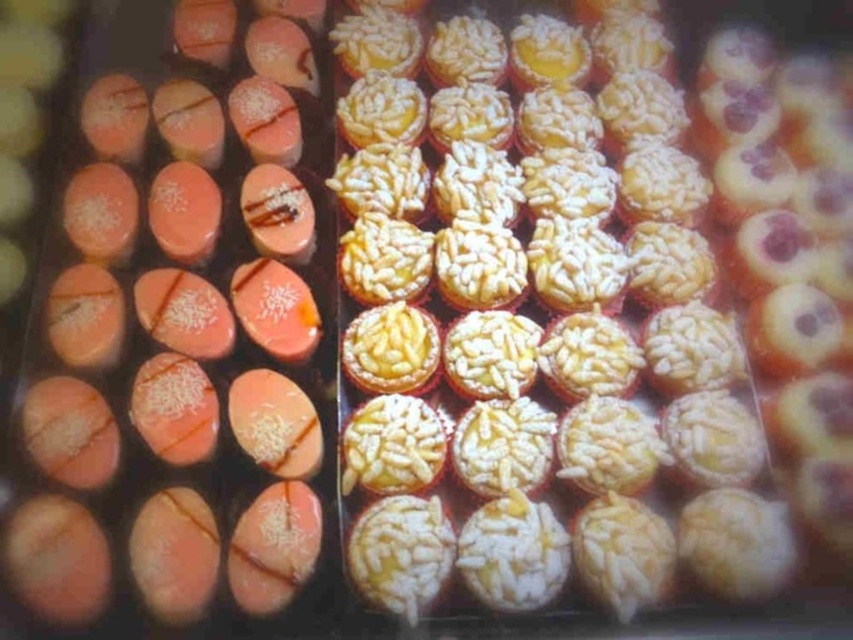
Question: Can you confirm if white sugary cupcake at center is positioned above matte pink chocolate at center?

Choices:
 (A) yes
 (B) no

Answer: (B)

Question: Which of the following is the farthest from the observer?

Choices:
 (A) (440, 144)
 (B) (51, 579)

Answer: (A)

Question: Where is white sugary cupcake at center located in relation to matte pink chocolate at center in the image?

Choices:
 (A) below
 (B) above

Answer: (A)

Question: Does white sugary cupcake at center have a greater width compared to matte pink chocolate at center?

Choices:
 (A) no
 (B) yes

Answer: (B)